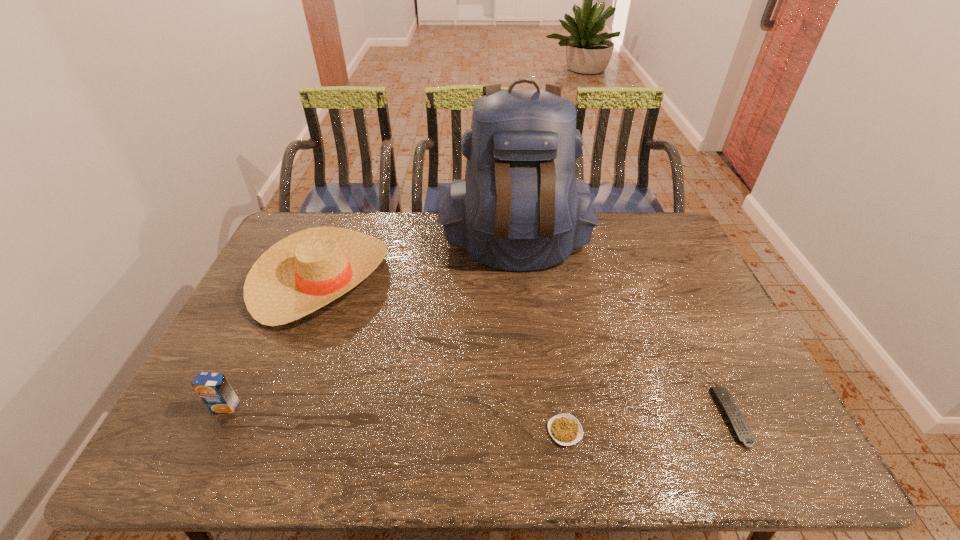
In order to click on free region at the near edge of the desktop in this screenshot , I will do [x=311, y=461].

The image size is (960, 540). I want to click on vacant area at the right edge, so click(721, 347).

You are a GUI agent. You are given a task and a screenshot of the screen. Output one action in this format:
    pyautogui.click(x=<x>, y=<y>)
    Task: Click on the free space at the near left corner of the desktop
    
    Given the screenshot: What is the action you would take?
    pyautogui.click(x=179, y=465)

You are a GUI agent. You are given a task and a screenshot of the screen. Output one action in this format:
    pyautogui.click(x=<x>, y=<y>)
    Task: Click on the blank space at the far right corner of the desktop
    The width and height of the screenshot is (960, 540).
    Given the screenshot: What is the action you would take?
    pyautogui.click(x=675, y=251)

Locate an element on the screen. The width and height of the screenshot is (960, 540). free space between the shortest object and the sunhat is located at coordinates (444, 355).

Image resolution: width=960 pixels, height=540 pixels. Identify the location of vacant space that is in between the sunhat and the orange_juice. (274, 342).

At what (x,y) coordinates should I click in order to perform the action: click on vacant point located between the sunhat and the rightmost object. Please return your answer as a coordinate pair (x, y). Looking at the image, I should click on (526, 348).

You are a GUI agent. You are given a task and a screenshot of the screen. Output one action in this format:
    pyautogui.click(x=<x>, y=<y>)
    Task: Click on the free point between the orange_juice and the remote control
    
    Given the screenshot: What is the action you would take?
    pyautogui.click(x=478, y=412)

Find the location of a particular element. Image resolution: width=960 pixels, height=540 pixels. free space between the orange_juice and the sunhat is located at coordinates (274, 342).

The image size is (960, 540). I want to click on free spot between the remote control and the sunhat, so click(x=526, y=348).